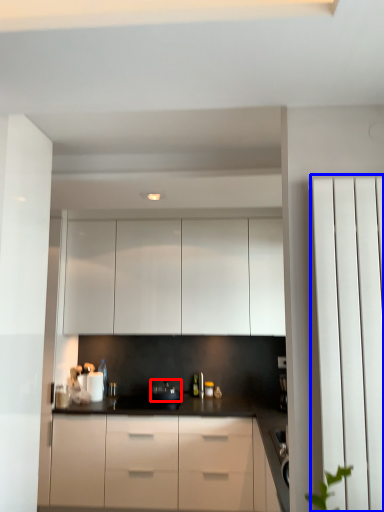
Question: Among these objects, which one is nearest to the camera, appliance (highlighted by a red box) or screen door (highlighted by a blue box)?

Choices:
 (A) appliance
 (B) screen door

Answer: (B)